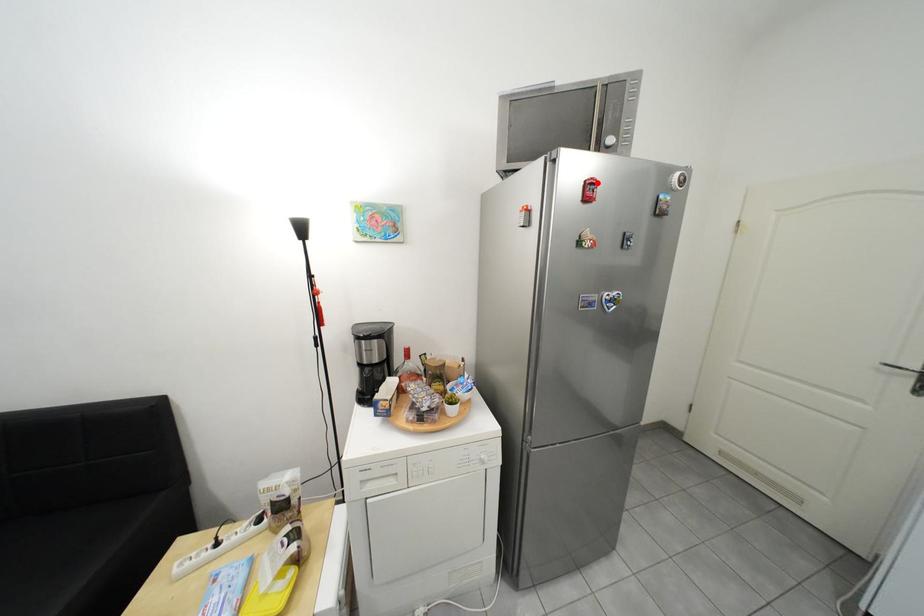
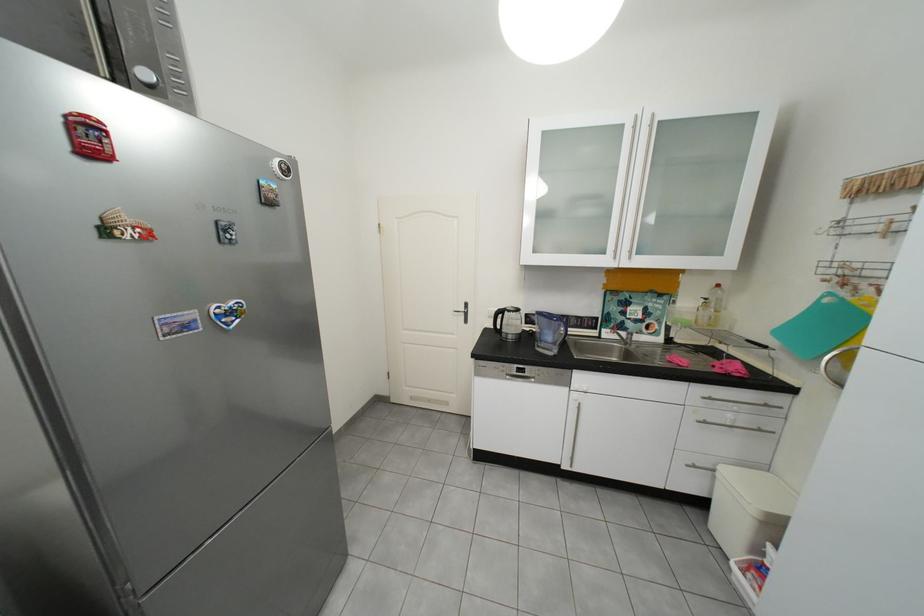
The point at the highlighted location is marked in the first image. Where is the corresponding point in the second image?

(77, 118)